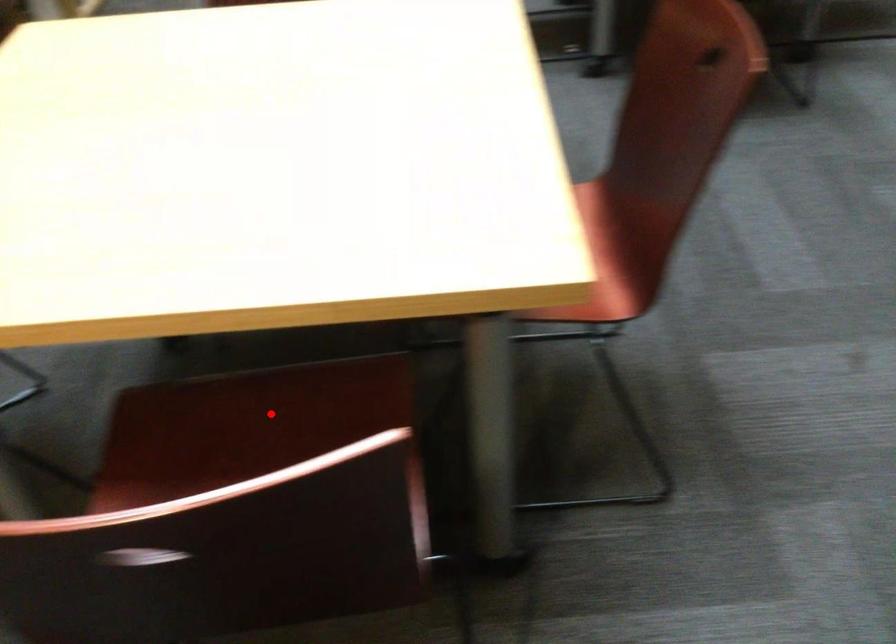
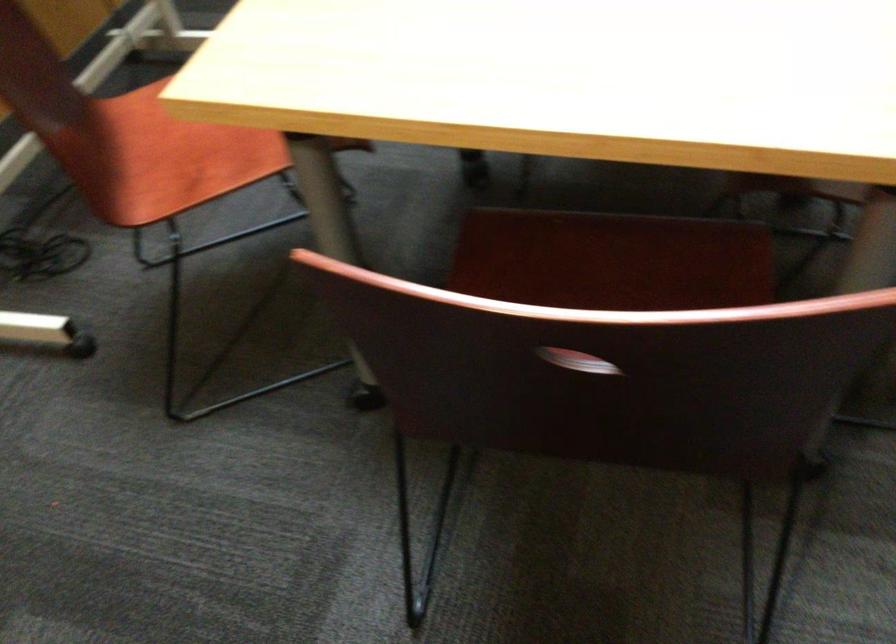
In the second image, find the point that corresponds to the highlighted location in the first image.

(612, 261)